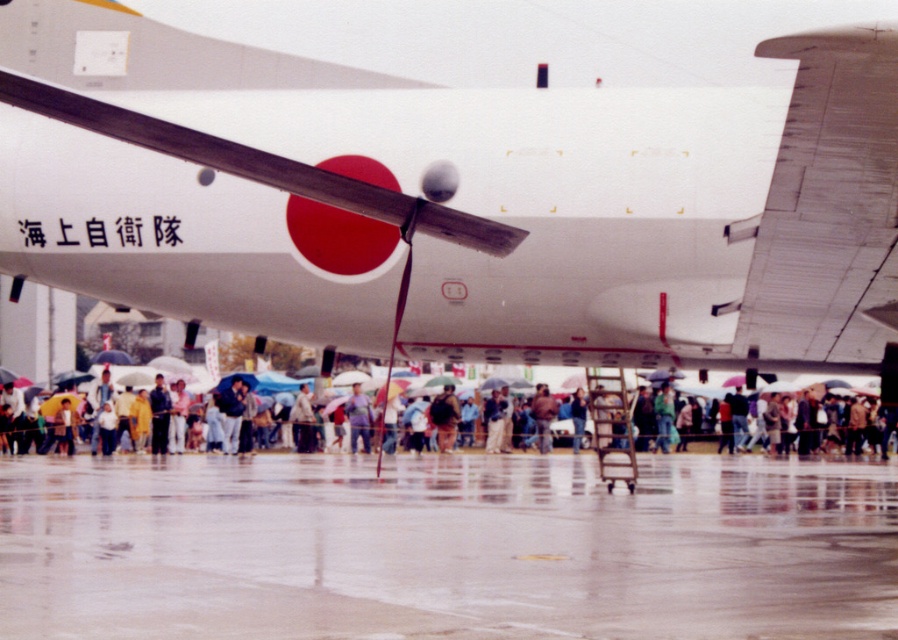
Who is positioned more to the right, white matte airplane at center or metallic gray wing at upper right?

Positioned to the right is metallic gray wing at upper right.

Is point (803, 157) positioned before point (887, 76)?

No, it is behind (887, 76).

The width and height of the screenshot is (898, 640). Identify the location of white matte airplane at center. (470, 202).

Looking at this image, between metallic gray wing at upper right and dark brown leather jacket at center, which one is positioned higher?

Positioned higher is metallic gray wing at upper right.

Who is taller, metallic gray wing at upper right or dark brown leather jacket at center?

With more height is dark brown leather jacket at center.

Is point (864, 141) farther from camera compared to point (447, 435)?

No.

Locate an element on the screen. The height and width of the screenshot is (640, 898). metallic gray wing at upper right is located at coordinates point(826,204).

Which is in front, point (331, 230) or point (429, 412)?

Point (331, 230)

Does white matte airplane at center appear under dark brown leather jacket at center?

Actually, white matte airplane at center is above dark brown leather jacket at center.

Who is more distant from viewer, (32, 241) or (445, 416)?

The point (445, 416) is more distant.

Locate an element on the screen. The width and height of the screenshot is (898, 640). white matte airplane at center is located at coordinates (470, 202).